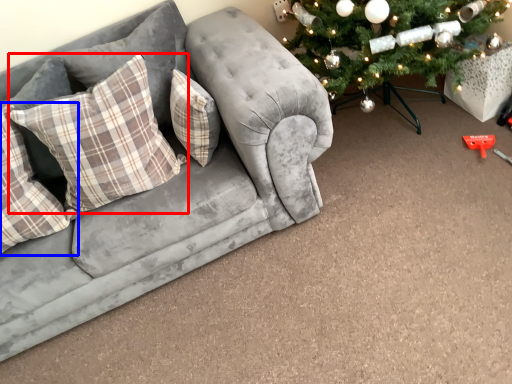
Question: Which object is closer to the camera taking this photo, pillow (highlighted by a red box) or pillow (highlighted by a blue box)?

Choices:
 (A) pillow
 (B) pillow

Answer: (B)